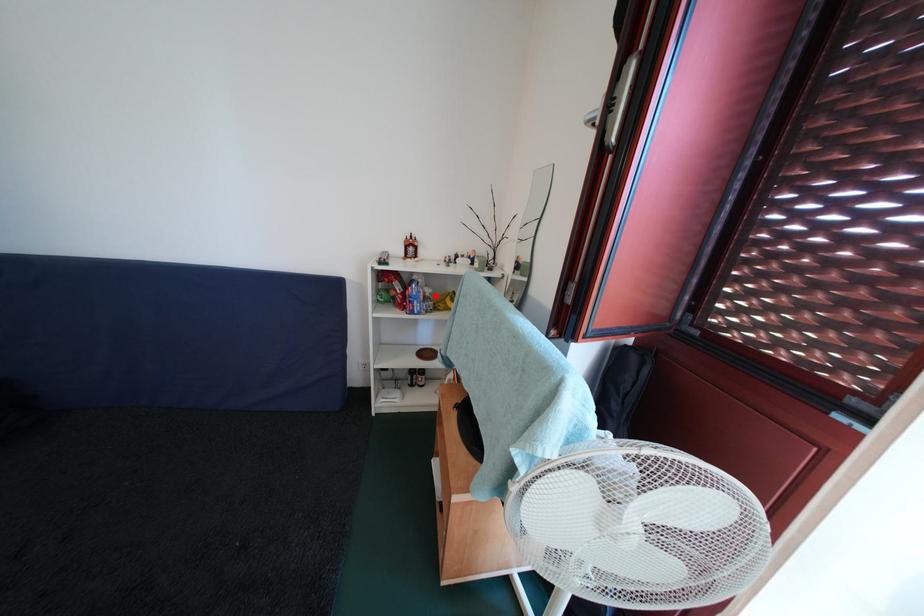
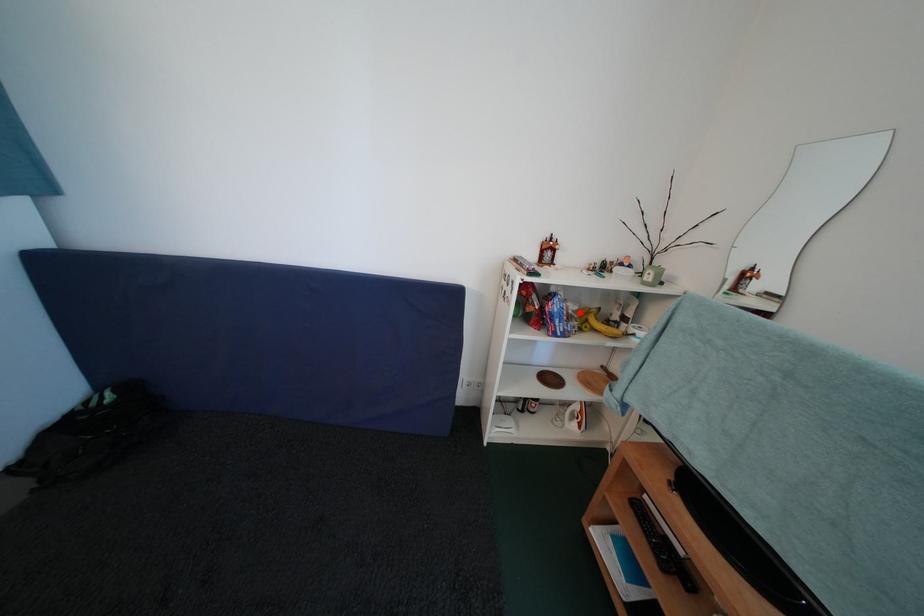
I am providing you with two images of the same scene from different viewpoints. A red point is marked on the first image and another point is marked on the second image. Is the red point in image1 aligned with the point shown in image2?

Yes